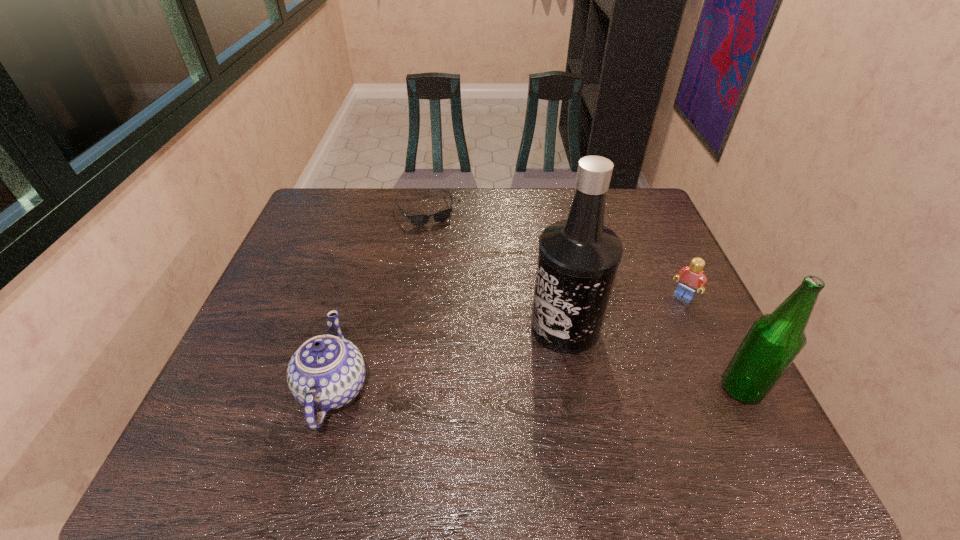
You are a GUI agent. You are given a task and a screenshot of the screen. Output one action in this format:
    pyautogui.click(x=<x>, y=<y>)
    Task: Click on the chinaware
    Image resolution: width=960 pixels, height=540 pixels.
    Given the screenshot: What is the action you would take?
    pyautogui.click(x=327, y=371)

Locate an element on the screen. This screenshot has height=540, width=960. beer bottle is located at coordinates (773, 342).

The width and height of the screenshot is (960, 540). In order to click on Lego in this screenshot , I will do `click(690, 278)`.

Identify the location of sunglasses. (419, 220).

I want to click on the shortest object, so click(419, 220).

Where is `liquor`? Image resolution: width=960 pixels, height=540 pixels. liquor is located at coordinates (578, 259).

I want to click on the tallest object, so click(578, 259).

In order to click on free location located 0.080m at the spout of the third tallest object in this screenshot , I will do `click(405, 389)`.

Locate an element on the screen. The height and width of the screenshot is (540, 960). vacant area situated on the front-facing side of the fourth tallest object is located at coordinates (596, 390).

Where is `vacant space located 0.230m on the front-facing side of the fourth tallest object`? The image size is (960, 540). vacant space located 0.230m on the front-facing side of the fourth tallest object is located at coordinates (632, 352).